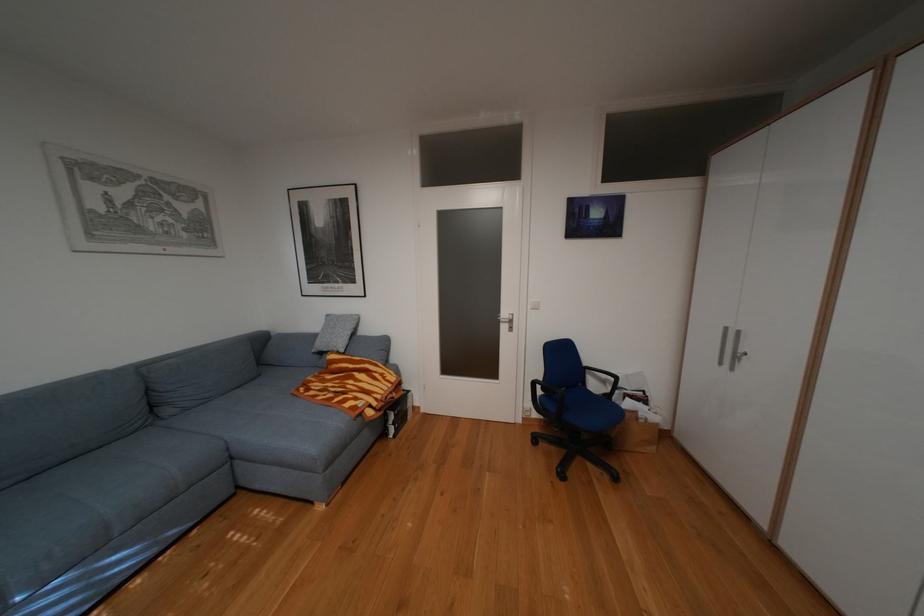
Find where to turn the metal door handle. Please return your answer as a coordinate pair (x, y).

(505, 318)